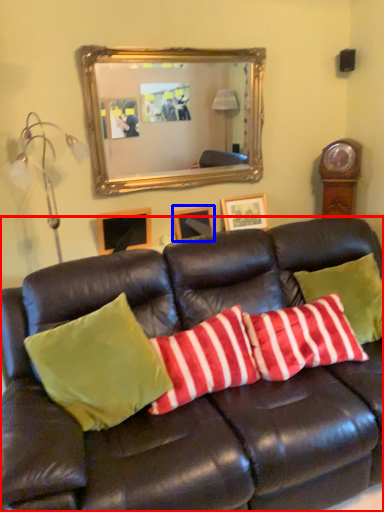
Question: Which of the following is the closest to the observer, studio couch (highlighted by a red box) or picture frame (highlighted by a blue box)?

Choices:
 (A) studio couch
 (B) picture frame

Answer: (A)